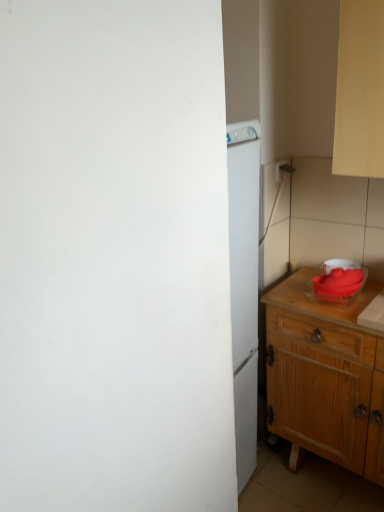
Image resolution: width=384 pixels, height=512 pixels. Find the location of `free space above wooden cabinet at right (from a real-world perspective)`. free space above wooden cabinet at right (from a real-world perspective) is located at coordinates (340, 301).